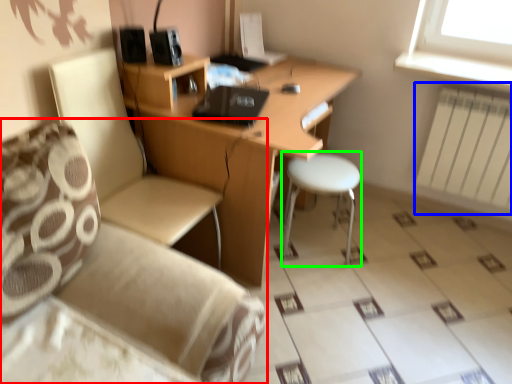
Question: Estimate the real-world distances between objects in this image. Which object is closer to studio couch (highlighted by a red box), radiator (highlighted by a blue box) or bar stool (highlighted by a green box)?

Choices:
 (A) radiator
 (B) bar stool

Answer: (B)